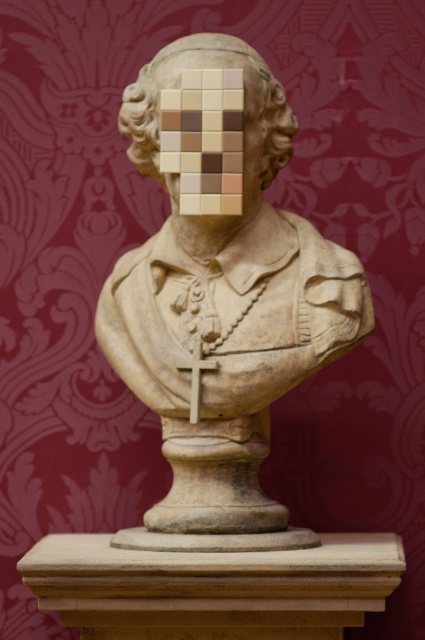
Question: Which point is closer to the camera?

Choices:
 (A) stone bust at center
 (B) white wood cross at center
 (C) matte stone bust at center

Answer: (A)

Question: Is matte stone bust at center behind white wood cross at center?

Choices:
 (A) no
 (B) yes

Answer: (B)

Question: Can you confirm if matte stone bust at center is positioned above white wood cross at center?

Choices:
 (A) no
 (B) yes

Answer: (B)

Question: Can you confirm if stone bust at center is bigger than matte stone bust at center?

Choices:
 (A) yes
 (B) no

Answer: (A)

Question: Estimate the real-world distances between objects in this image. Which object is closer to the white wood cross at center?

Choices:
 (A) matte stone bust at center
 (B) stone bust at center

Answer: (B)

Question: Among these objects, which one is nearest to the camera?

Choices:
 (A) stone bust at center
 (B) matte stone bust at center
 (C) white wood cross at center

Answer: (A)